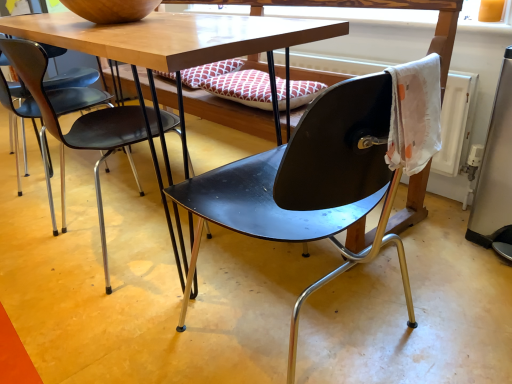
You are a GUI agent. You are given a task and a screenshot of the screen. Output one action in this format:
    pyautogui.click(x=<x>, y=<y>)
    Task: Click on the vacant space underneath matte black chair at center, placed as the 2th chair when sorted from left to right (from a real-world perspective)
    
    Given the screenshot: What is the action you would take?
    pyautogui.click(x=314, y=328)